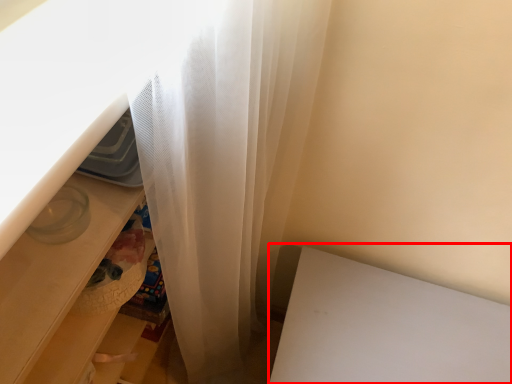
Question: From the image's perspective, what is the correct spatial positioning of table (annotated by the red box) in reference to drawer?

Choices:
 (A) above
 (B) below

Answer: (B)